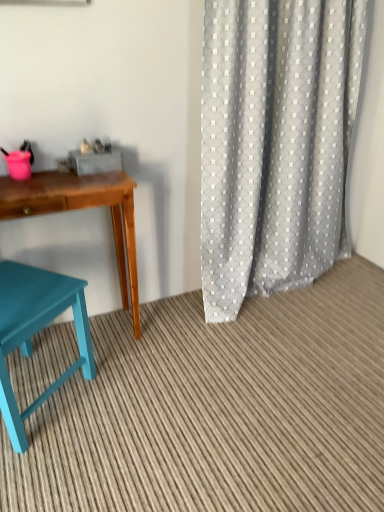
You are a GUI agent. You are given a task and a screenshot of the screen. Output one action in this format:
    pyautogui.click(x=<x>, y=<y>)
    Task: Click on the free spot below gray textured curtain at right (from a real-world perspective)
    The height and width of the screenshot is (512, 384).
    Given the screenshot: What is the action you would take?
    pyautogui.click(x=303, y=289)